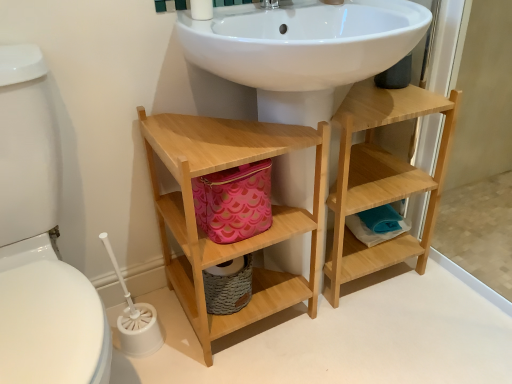
Question: Is white glossy toilet bowl at left taller than white plastic toilet brush at lower left?

Choices:
 (A) yes
 (B) no

Answer: (A)

Question: Does white glossy toilet bowl at left come in front of white plastic toilet brush at lower left?

Choices:
 (A) yes
 (B) no

Answer: (A)

Question: Considering the relative sizes of white glossy toilet bowl at left and white plastic toilet brush at lower left in the image provided, is white glossy toilet bowl at left smaller than white plastic toilet brush at lower left?

Choices:
 (A) yes
 (B) no

Answer: (B)

Question: Is white glossy toilet bowl at left next to white plastic toilet brush at lower left and touching it?

Choices:
 (A) no
 (B) yes

Answer: (A)

Question: From a real-world perspective, is white glossy toilet bowl at left on white plastic toilet brush at lower left?

Choices:
 (A) no
 (B) yes

Answer: (B)

Question: From a real-world perspective, is natural wood shelf at center positioned above or below natural wood bathroom cabinet at lower center?

Choices:
 (A) above
 (B) below

Answer: (B)

Question: Is natural wood shelf at center bigger or smaller than natural wood bathroom cabinet at lower center?

Choices:
 (A) small
 (B) big

Answer: (A)

Question: From their relative heights in the image, would you say natural wood shelf at center is taller or shorter than natural wood bathroom cabinet at lower center?

Choices:
 (A) short
 (B) tall

Answer: (A)

Question: Is point (384, 167) positioned closer to the camera than point (183, 211)?

Choices:
 (A) farther
 (B) closer

Answer: (A)

Question: Is white glossy toilet bowl at left inside the boundaries of natural wood shelf at center, or outside?

Choices:
 (A) outside
 (B) inside

Answer: (A)

Question: In the image, is white glossy toilet bowl at left on the left side or the right side of natural wood shelf at center?

Choices:
 (A) left
 (B) right

Answer: (A)

Question: Is white glossy toilet bowl at left bigger or smaller than natural wood shelf at center?

Choices:
 (A) small
 (B) big

Answer: (B)

Question: Considering the positions of white glossy toilet bowl at left and natural wood shelf at center in the image, is white glossy toilet bowl at left wider or thinner than natural wood shelf at center?

Choices:
 (A) wide
 (B) thin

Answer: (A)

Question: Is natural wood bathroom cabinet at lower center to the left or to the right of white glossy toilet bowl at left in the image?

Choices:
 (A) right
 (B) left

Answer: (A)

Question: Does point (161, 215) appear closer or farther from the camera than point (52, 165)?

Choices:
 (A) farther
 (B) closer

Answer: (A)